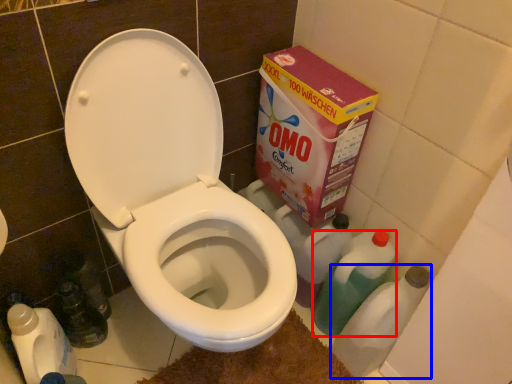
Question: Which object is further to the camera taking this photo, cleaning product (highlighted by a red box) or bottle (highlighted by a blue box)?

Choices:
 (A) cleaning product
 (B) bottle

Answer: (A)